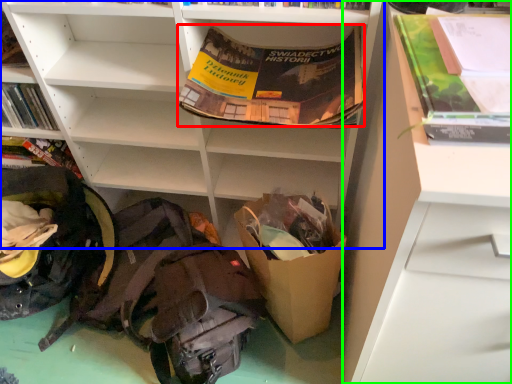
Question: Which is farther away from paperback book (highlighted by a red box)? shelf (highlighted by a blue box) or shelf (highlighted by a green box)?

Choices:
 (A) shelf
 (B) shelf

Answer: (B)